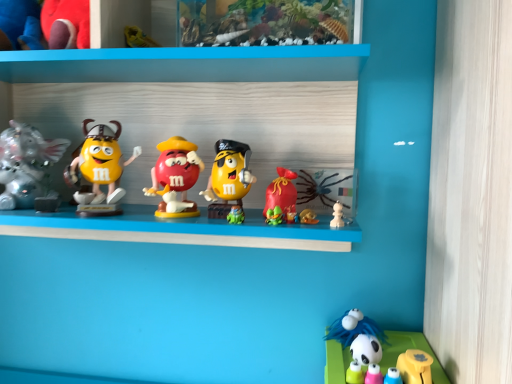
Question: Does matte plastic m&m figure at center, the fourth toy when ordered from left to right, appear on the left side of matte yellow figurine at left, acting as the third toy starting from the left?

Choices:
 (A) no
 (B) yes

Answer: (A)

Question: Does matte plastic m&m figure at center, the fourth toy when ordered from left to right, lie behind matte yellow figurine at left, the 5th toy positioned from the right?

Choices:
 (A) no
 (B) yes

Answer: (A)

Question: Is matte plastic m&m figure at center, the fourth toy when ordered from left to right, thinner than matte yellow figurine at left, acting as the third toy starting from the left?

Choices:
 (A) no
 (B) yes

Answer: (A)

Question: Does matte plastic m&m figure at center, arranged as the 4th toy when viewed from the right, have a greater width compared to matte yellow figurine at left, acting as the third toy starting from the left?

Choices:
 (A) yes
 (B) no

Answer: (A)

Question: From the image's perspective, is matte plastic m&m figure at center, arranged as the 4th toy when viewed from the right, above matte yellow figurine at left, the 5th toy positioned from the right?

Choices:
 (A) yes
 (B) no

Answer: (B)

Question: Considering the relative sizes of matte plastic m&m figure at center, the fourth toy when ordered from left to right, and matte yellow figurine at left, acting as the third toy starting from the left, in the image provided, is matte plastic m&m figure at center, the fourth toy when ordered from left to right, taller than matte yellow figurine at left, acting as the third toy starting from the left,?

Choices:
 (A) no
 (B) yes

Answer: (A)

Question: Is white glossy panda at lower right inside velvet plush toy at upper left, which appears as the 1th toy when viewed from the left?

Choices:
 (A) no
 (B) yes

Answer: (A)

Question: From a real-world perspective, is velvet plush toy at upper left, which appears as the 1th toy when viewed from the left, located higher than white glossy panda at lower right?

Choices:
 (A) yes
 (B) no

Answer: (A)

Question: Is velvet plush toy at upper left, which is counted as the seventh toy, starting from the right, looking in the opposite direction of white glossy panda at lower right?

Choices:
 (A) no
 (B) yes

Answer: (A)

Question: Is velvet plush toy at upper left, which is counted as the seventh toy, starting from the right, at the right side of white glossy panda at lower right?

Choices:
 (A) yes
 (B) no

Answer: (B)

Question: Is velvet plush toy at upper left, which appears as the 1th toy when viewed from the left, located outside white glossy panda at lower right?

Choices:
 (A) no
 (B) yes

Answer: (B)

Question: Considering the relative sizes of velvet plush toy at upper left, which is counted as the seventh toy, starting from the right, and white glossy panda at lower right in the image provided, is velvet plush toy at upper left, which is counted as the seventh toy, starting from the right, smaller than white glossy panda at lower right?

Choices:
 (A) no
 (B) yes

Answer: (A)

Question: Is silver metallic elephant at left, which is the 6th toy from right to left, far from matte plastic m&m figure at center, the fourth toy when ordered from left to right?

Choices:
 (A) yes
 (B) no

Answer: (B)